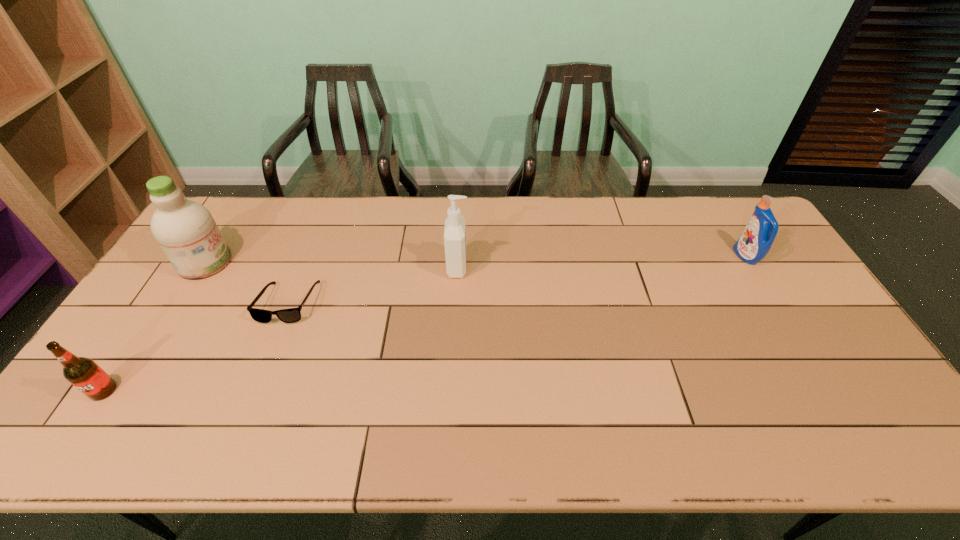
This screenshot has width=960, height=540. Find the location of `object that stands as the third closest to the nearest object`. object that stands as the third closest to the nearest object is located at coordinates (455, 225).

At what (x,y) coordinates should I click in order to perform the action: click on vacant space that satisfies the following two spatial constraints: 1. on the front label of the fourth object from left to right; 2. on the front side of the root beer. Please return your answer as a coordinate pair (x, y). Looking at the image, I should click on (452, 390).

What are the coordinates of `free spot that satisfies the following two spatial constraints: 1. on the label of the detergent; 2. on the front side of the root beer` in the screenshot? It's located at (828, 390).

At what (x,y) coordinates should I click in order to perform the action: click on vacant space that satisfies the following two spatial constraints: 1. on the label of the detergent; 2. on the front-facing side of the third object from left to right. Please return your answer as a coordinate pair (x, y). This screenshot has height=540, width=960. Looking at the image, I should click on (775, 303).

You are a GUI agent. You are given a task and a screenshot of the screen. Output one action in this format:
    pyautogui.click(x=<x>, y=<y>)
    Task: Click on the free space that satisfies the following two spatial constraints: 1. on the label of the detergent; 2. on the front-facing side of the third object from left to right
    The width and height of the screenshot is (960, 540).
    Given the screenshot: What is the action you would take?
    pyautogui.click(x=775, y=303)